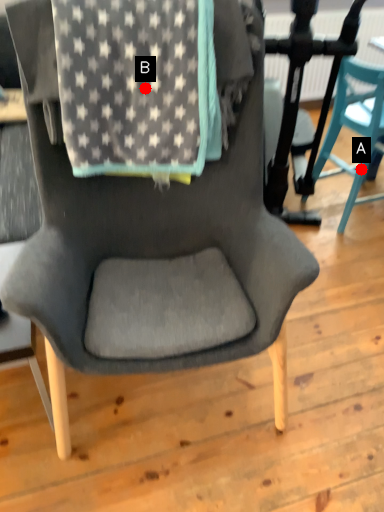
Question: Two points are circled on the image, labeled by A and B beside each circle. Which point appears farthest from the camera in this image?

Choices:
 (A) A is further
 (B) B is further

Answer: (A)